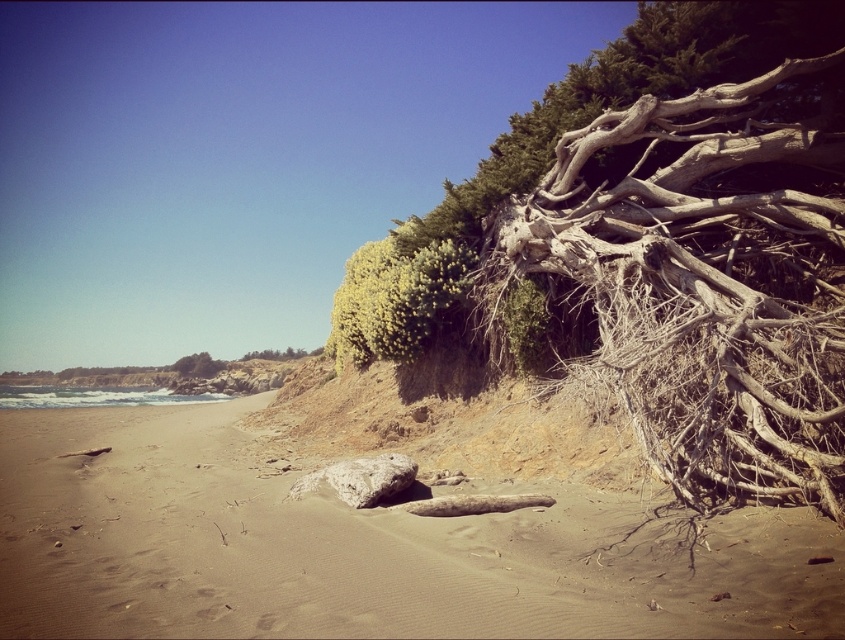
You are standing at the center of the image and want to walk to the brown sandy beach at lower center. Which direction should you move in to reach it?

The brown sandy beach at lower center is located at point 0.859 on the horizontal axis and 0.428 on the vertical axis. Since you are at the center, you should move towards the lower part of the image to reach it.

You are a hiker exploring the coastal area and want to place a small tent on the brown sandy beach at lower center or the gray rough rock at center. Which location would you choose and why?

You should choose the brown sandy beach at lower center because it is bigger than the gray rough rock at center, providing a more stable and spacious area for setting up the tent.

You are standing at the center of the beach and want to reach the driftwood at upper right. Which direction should you move to get there?

The driftwood at upper right is located at point (582, 128), so you should move northeast to reach it.